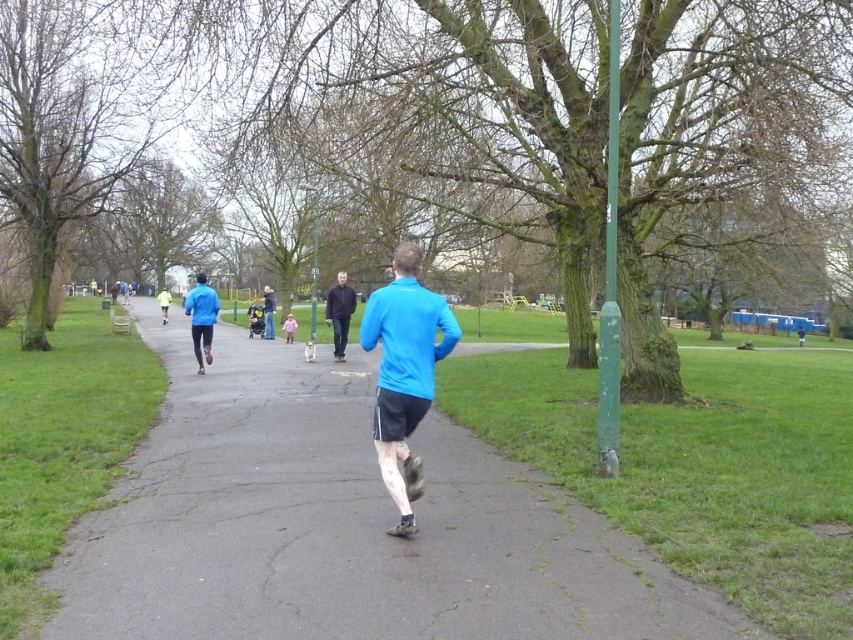
Is the position of blue fabric jacket at center less distant than that of neon yellow jacket at center?

Yes, blue fabric jacket at center is closer to the viewer.

Which is more to the left, blue fabric jacket at center or neon yellow jacket at center?

neon yellow jacket at center is more to the left.

This screenshot has width=853, height=640. What do you see at coordinates (201, 317) in the screenshot?
I see `blue fabric jacket at center` at bounding box center [201, 317].

Image resolution: width=853 pixels, height=640 pixels. In order to click on blue fabric jacket at center in this screenshot , I will do `click(201, 317)`.

Does blue matte jacket at center have a greater width compared to neon yellow jacket at center?

No, blue matte jacket at center is not wider than neon yellow jacket at center.

Does blue matte jacket at center have a lesser height compared to neon yellow jacket at center?

Yes.

At what (x,y) coordinates should I click in order to perform the action: click on blue matte jacket at center. Please return your answer as a coordinate pair (x, y). This screenshot has width=853, height=640. Looking at the image, I should click on (404, 372).

Identify the location of blue matte jacket at center. (404, 372).

Is the position of neon yellow jacket at center less distant than that of pink fabric child at center?

That is False.

Consider the image. Is neon yellow jacket at center positioned at the back of pink fabric child at center?

Yes.

Who is more forward, (166, 298) or (289, 328)?

Point (289, 328) is in front.

The image size is (853, 640). In order to click on neon yellow jacket at center in this screenshot , I will do `click(164, 304)`.